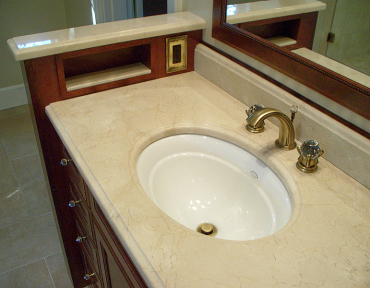
This screenshot has width=370, height=288. I want to click on mirror, so click(318, 36).